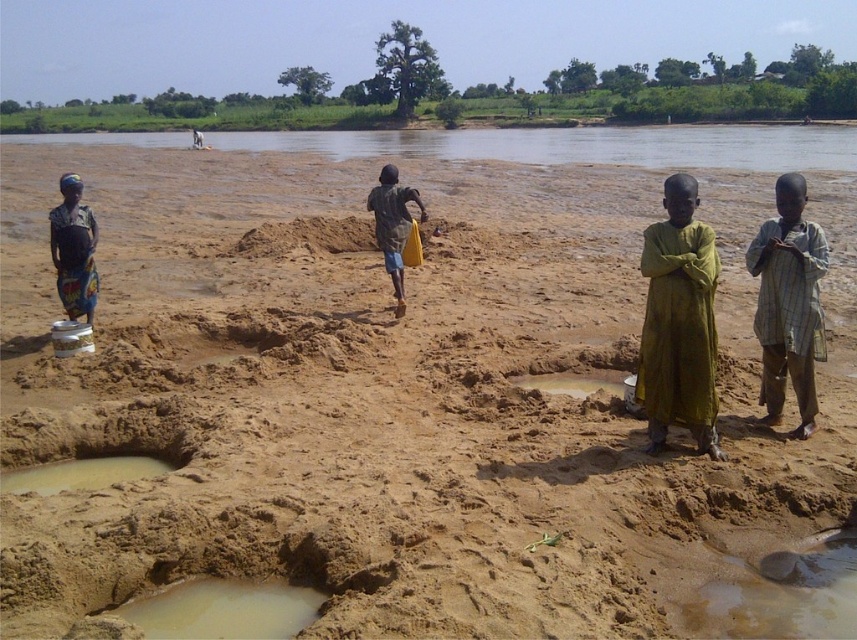
Is point (249, 618) positioned after point (22, 490)?

No, (249, 618) is in front of (22, 490).

Who is more forward, (196,602) or (16,484)?

Positioned in front is point (196,602).

This screenshot has height=640, width=857. Find the location of `muddy sand pit at lower left`. muddy sand pit at lower left is located at coordinates (225, 609).

Who is higher up, matte green dress at left or yellow fabric bag at center?

matte green dress at left is above.

Does matte green dress at left have a greater width compared to yellow fabric bag at center?

Indeed, matte green dress at left has a greater width compared to yellow fabric bag at center.

Is point (58, 250) closer to camera compared to point (381, 250)?

Yes, it is.

In order to click on matte green dress at left in this screenshot , I will do pos(75,250).

Where is `light brown plaid shirt at right`? This screenshot has width=857, height=640. light brown plaid shirt at right is located at coordinates (788, 301).

Does light brown plaid shirt at right appear over matte green dress at left?

No.

Where is `light brown plaid shirt at right`? The image size is (857, 640). light brown plaid shirt at right is located at coordinates (788, 301).